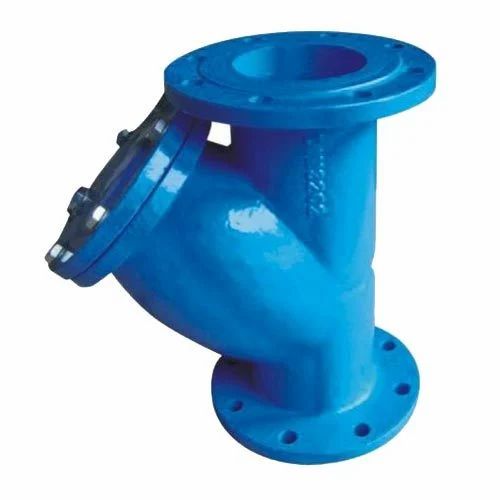
Find the location of a particular element. screws is located at coordinates (92, 222), (55, 254), (73, 197), (121, 136), (159, 129).